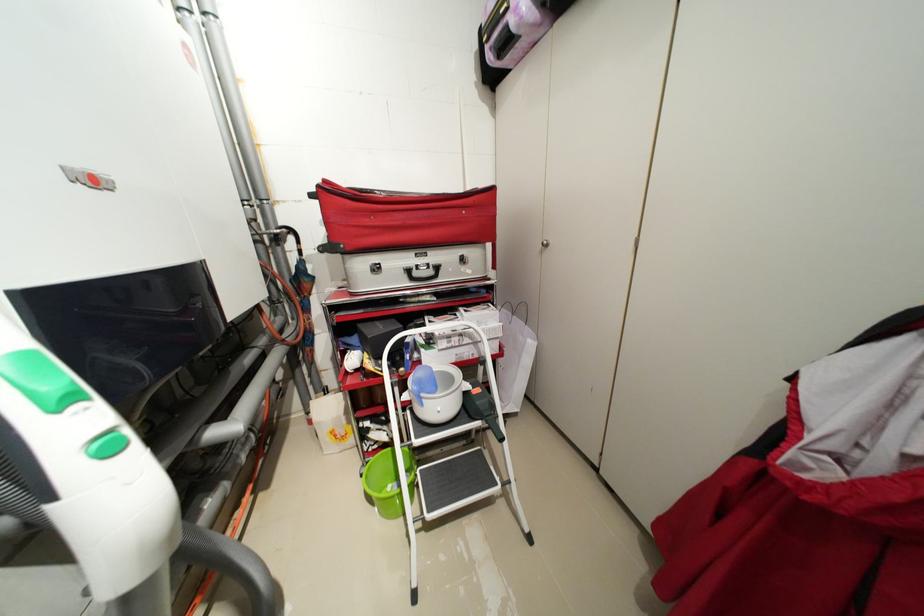
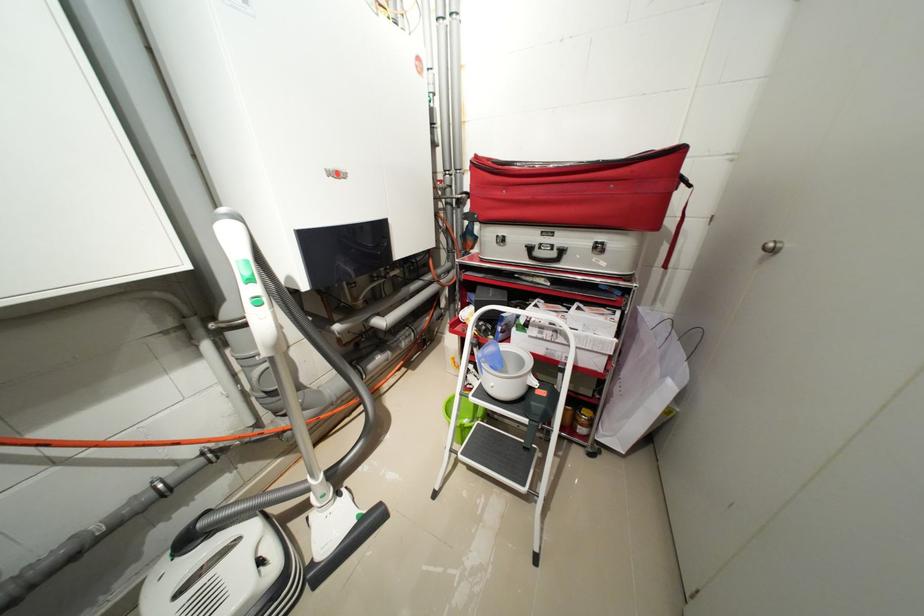
Question: Based on the continuous images, in which direction is the camera rotating? Reply with the corresponding letter.

Choices:
 (A) Left
 (B) Right
 (C) Up
 (D) Down

Answer: (A)